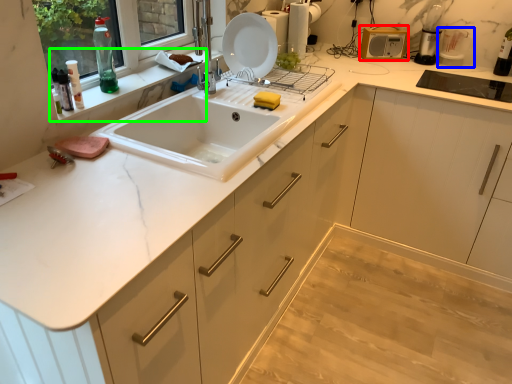
Question: Which object is the closest to the appliance (highlighted by a red box)? Choose among these: appliance (highlighted by a blue box) or window sill (highlighted by a green box).

Choices:
 (A) appliance
 (B) window sill

Answer: (A)